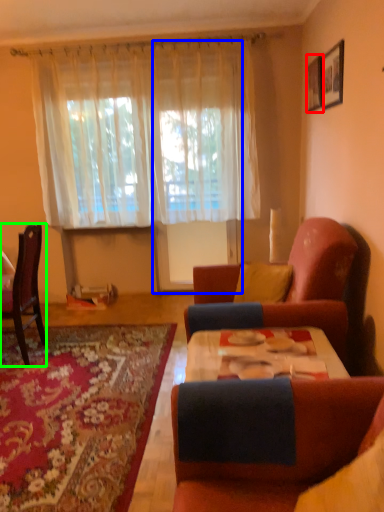
Question: Which object is positioned farthest from picture frame (highlighted by a red box)? Select from glass door (highlighted by a blue box) and chair (highlighted by a green box).

Choices:
 (A) glass door
 (B) chair

Answer: (B)